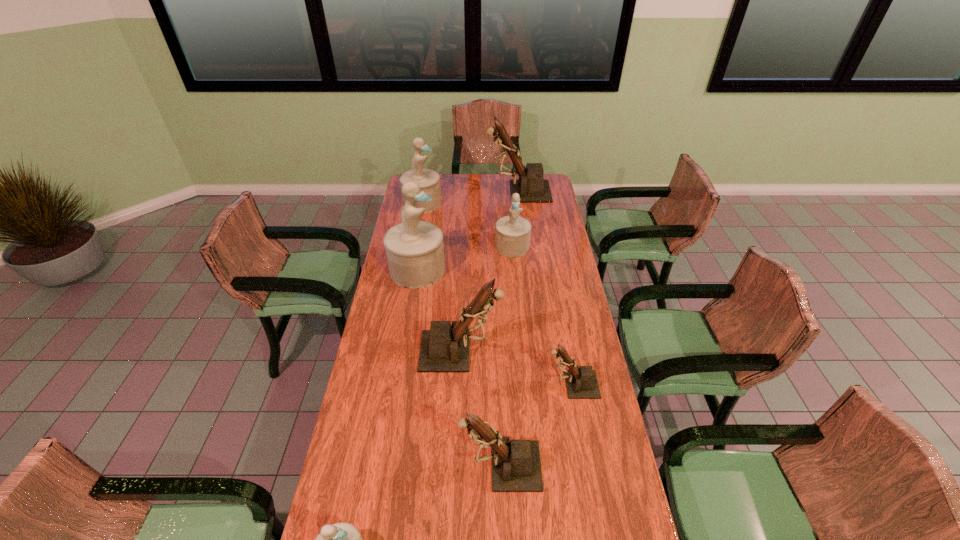
At what (x,y) coordinates should I click in order to perform the action: click on the biggest brown figurine. Please return your answer as a coordinate pair (x, y). Looking at the image, I should click on (531, 186).

At what (x,y) coordinates should I click in order to perform the action: click on the biggest white figurine. Please return your answer as a coordinate pair (x, y). This screenshot has height=540, width=960. Looking at the image, I should click on (415, 251).

This screenshot has height=540, width=960. In order to click on the second biggest white figurine in this screenshot , I will do `click(429, 180)`.

What are the coordinates of `the second biggest brown figurine` in the screenshot? It's located at (444, 348).

This screenshot has height=540, width=960. What are the coordinates of `the second smallest white figurine` in the screenshot? It's located at (512, 233).

Identify the location of the seventh farthest object. (516, 466).

Locate an element on the screen. Image resolution: width=960 pixels, height=540 pixels. the seventh farthest figurine is located at coordinates (516, 466).

The image size is (960, 540). I want to click on the smallest brown figurine, so click(x=581, y=383).

Find the location of a particular element. This screenshot has height=540, width=960. vacant space located on the front-facing side of the biggest brown figurine is located at coordinates tap(426, 192).

This screenshot has width=960, height=540. I want to click on vacant space located 0.090m on the front-facing side of the biggest brown figurine, so click(470, 192).